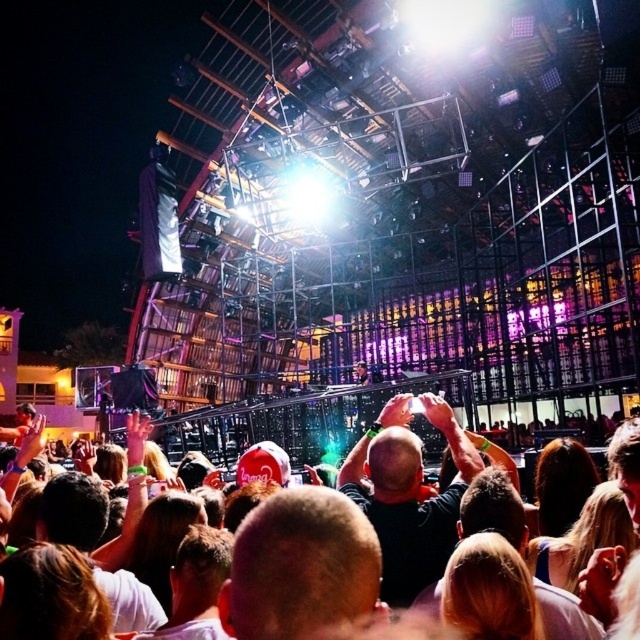
You are standing at the concert venue and want to reach the point marked as point [433,513]. If your walking speed is 3 feet per second, how many seconds will it take you to reach that point?

The distance between you and point [433,513] is 189.47 feet. At a speed of 3 feet per second, it will take approximately 63.16 seconds to reach the point.

You are a photographer at the concert and want to capture a photo of the dark gray shirt at center without the white cloth crowd at center appearing in the foreground. Is this possible?

The white cloth crowd at center is behind the dark gray shirt at center, so yes, the photographer can capture the dark gray shirt at center without the white cloth crowd at center in the foreground because the crowd is behind it.